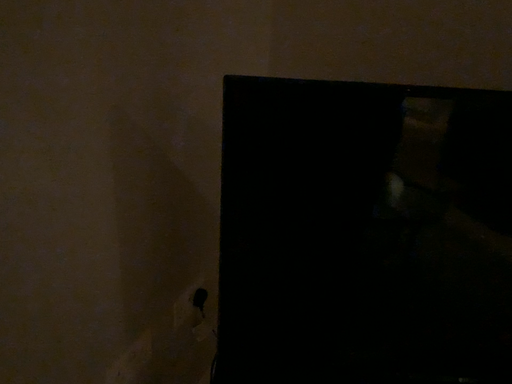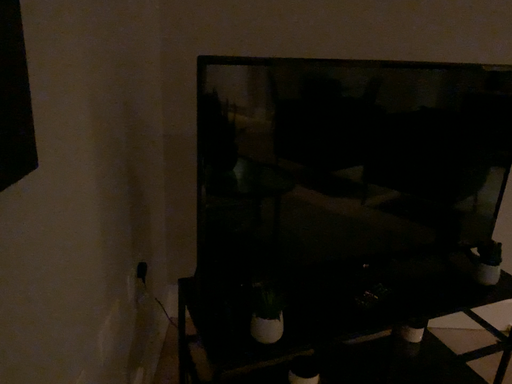
Question: How did the camera likely rotate when shooting the video?

Choices:
 (A) rotated left
 (B) rotated right

Answer: (B)